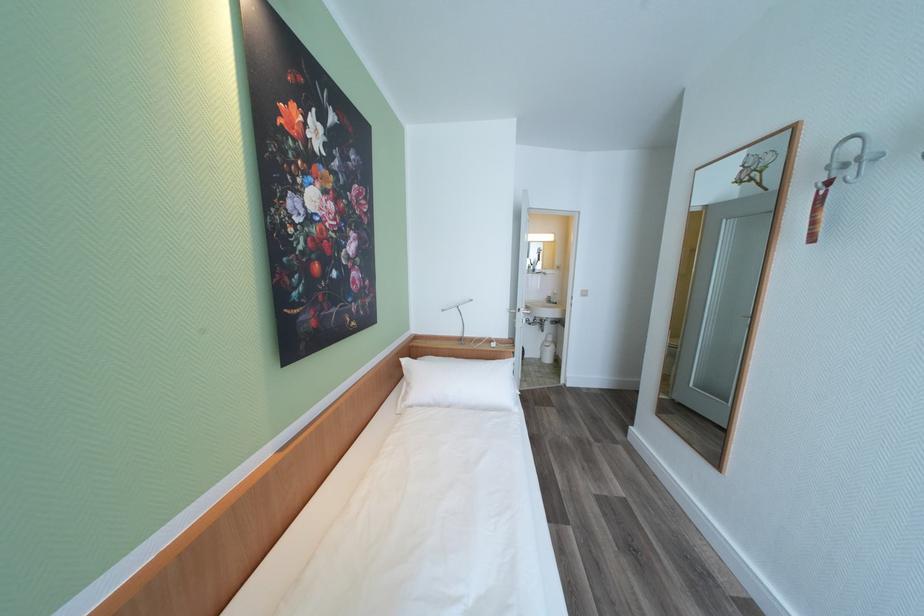
This screenshot has height=616, width=924. I want to click on silver lamp head, so click(458, 317).